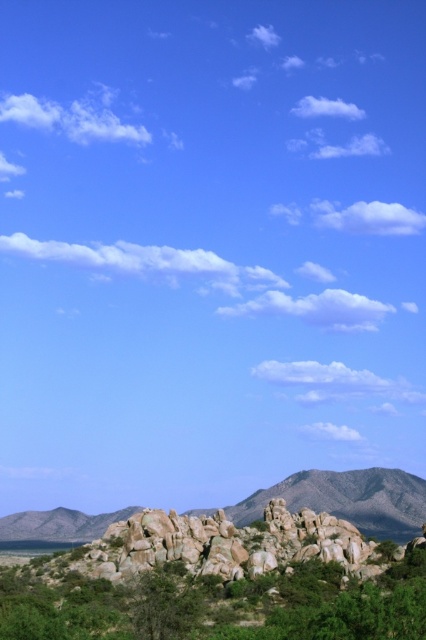
How far apart are green leafy shrubs at lower center and rocky gray mountain at lower right?

green leafy shrubs at lower center and rocky gray mountain at lower right are 105.33 meters apart.

How much distance is there between green leafy shrubs at lower center and rocky gray mountain at lower right?

green leafy shrubs at lower center and rocky gray mountain at lower right are 105.33 meters apart from each other.

What do you see at coordinates (218, 604) in the screenshot?
I see `green leafy shrubs at lower center` at bounding box center [218, 604].

I want to click on green leafy shrubs at lower center, so click(x=218, y=604).